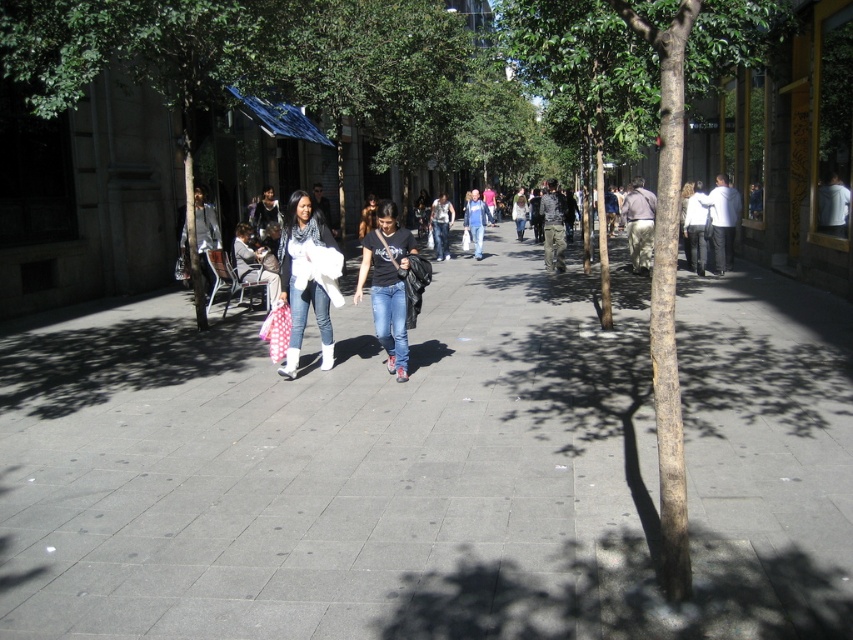
Question: Among these points, which one is farthest from the camera?

Choices:
 (A) (442, 240)
 (B) (622, 337)

Answer: (A)

Question: Is black matte t-shirt at center wider than blue jeans at center?

Choices:
 (A) yes
 (B) no

Answer: (B)

Question: Can you confirm if smooth brown tree trunk at center is positioned to the right of denim jeans at center?

Choices:
 (A) yes
 (B) no

Answer: (A)

Question: Is the position of smooth brown tree trunk at center less distant than that of white matte jacket at center?

Choices:
 (A) no
 (B) yes

Answer: (B)

Question: Which point is closer to the camera?

Choices:
 (A) blue jeans at center
 (B) gray concrete sidewalk at center
 (C) black matte t-shirt at center

Answer: (B)

Question: Which point is farther to the camera?

Choices:
 (A) gray concrete sidewalk at center
 (B) white matte jacket at center
 (C) blue jeans at center
 (D) black matte t-shirt at center

Answer: (C)